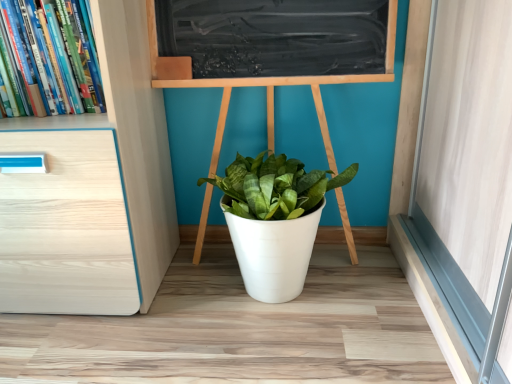
Question: Is hardcover books at left positioned in front of white matte pot at center?

Choices:
 (A) no
 (B) yes

Answer: (B)

Question: Does hardcover books at left appear on the left side of white matte pot at center?

Choices:
 (A) no
 (B) yes

Answer: (B)

Question: Are hardcover books at left and white matte pot at center beside each other?

Choices:
 (A) no
 (B) yes

Answer: (A)

Question: From a real-world perspective, is hardcover books at left located beneath white matte pot at center?

Choices:
 (A) yes
 (B) no

Answer: (B)

Question: From the image's perspective, is hardcover books at left below white matte pot at center?

Choices:
 (A) no
 (B) yes

Answer: (A)

Question: Considering the relative sizes of hardcover books at left and white matte pot at center in the image provided, is hardcover books at left wider than white matte pot at center?

Choices:
 (A) no
 (B) yes

Answer: (A)

Question: Is white matte pot at center far away from hardcover books at left?

Choices:
 (A) no
 (B) yes

Answer: (A)

Question: From the image's perspective, is white matte pot at center above hardcover books at left?

Choices:
 (A) yes
 (B) no

Answer: (B)

Question: Is white matte pot at center to the right of hardcover books at left from the viewer's perspective?

Choices:
 (A) no
 (B) yes

Answer: (B)

Question: Is white matte pot at center smaller than hardcover books at left?

Choices:
 (A) yes
 (B) no

Answer: (B)

Question: Is hardcover books at left at the back of white matte pot at center?

Choices:
 (A) no
 (B) yes

Answer: (A)

Question: Is white matte pot at center oriented towards hardcover books at left?

Choices:
 (A) no
 (B) yes

Answer: (A)

Question: In terms of size, does white matte pot at center appear bigger or smaller than hardcover books at left?

Choices:
 (A) small
 (B) big

Answer: (B)